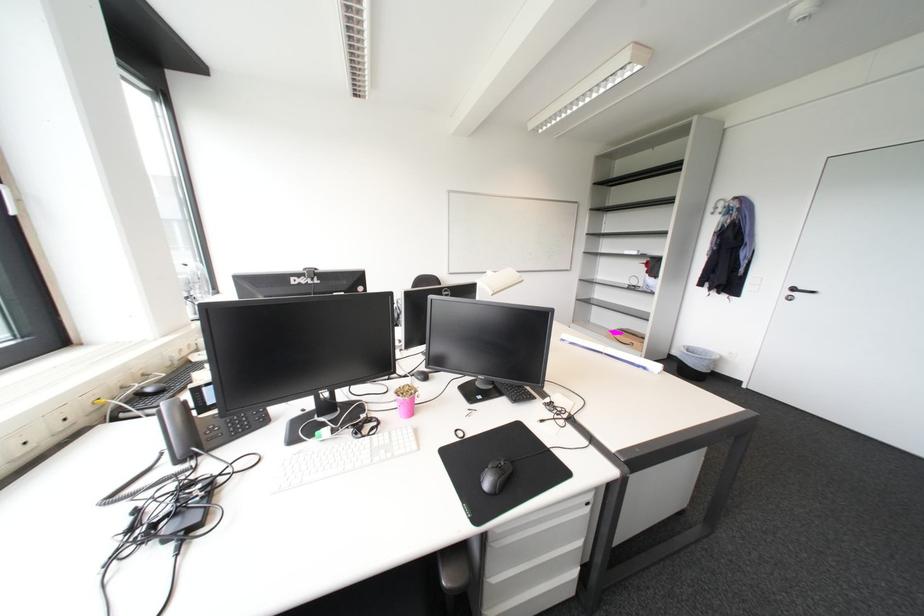
Where would you pull the drawer handle? Please return your answer as a coordinate pair (x, y).

(541, 521)